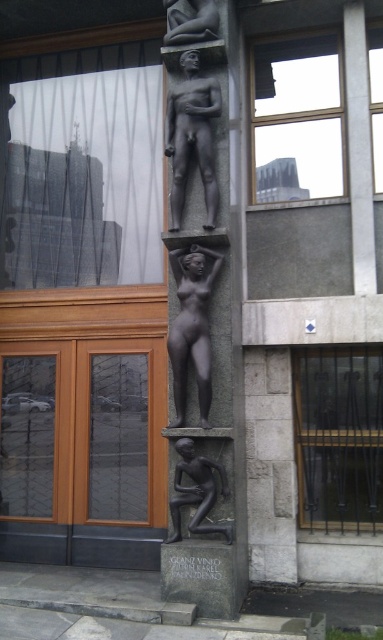
Is point (317, 456) closer to camera compared to point (214, 6)?

No.

What do you see at coordinates (338, 436) in the screenshot? I see `black wrought iron bars at right` at bounding box center [338, 436].

Locate an element on the screen. This screenshot has width=383, height=640. black wrought iron bars at right is located at coordinates (338, 436).

Can you confirm if transparent glass window at upper center is positioned to the right of bronze statue at center?

Indeed, transparent glass window at upper center is positioned on the right side of bronze statue at center.

Between point (340, 108) and point (173, 156), which one is positioned behind?

Positioned behind is point (340, 108).

Where is `transparent glass window at upper center`? Image resolution: width=383 pixels, height=640 pixels. transparent glass window at upper center is located at coordinates (296, 118).

Does bronze statue at center have a lesser width compared to bronze figure at lower center?

Indeed, bronze statue at center has a lesser width compared to bronze figure at lower center.

Between bronze statue at center and bronze figure at lower center, which one has less height?

Standing shorter between the two is bronze figure at lower center.

Identify the location of bronze statue at center. The image size is (383, 640). (191, 136).